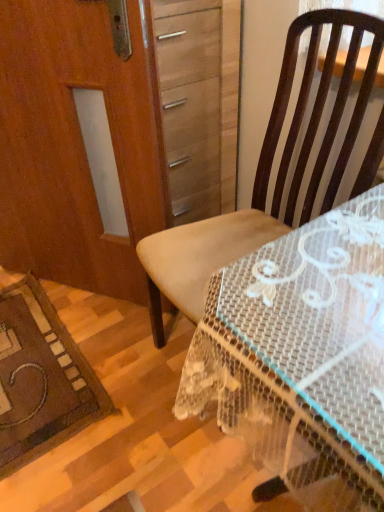
Question: Is wooden screen door at left in front of or behind clear plastic table at center in the image?

Choices:
 (A) front
 (B) behind

Answer: (B)

Question: From the image's perspective, relative to clear plastic table at center, is wooden screen door at left above or below?

Choices:
 (A) above
 (B) below

Answer: (A)

Question: Based on their relative distances, which object is farther from the wooden screen door at left?

Choices:
 (A) clear plastic table at center
 (B) brown fabric chair at center

Answer: (A)

Question: Estimate the real-world distances between objects in this image. Which object is farther from the wooden screen door at left?

Choices:
 (A) brown fabric chair at center
 (B) clear plastic table at center

Answer: (B)